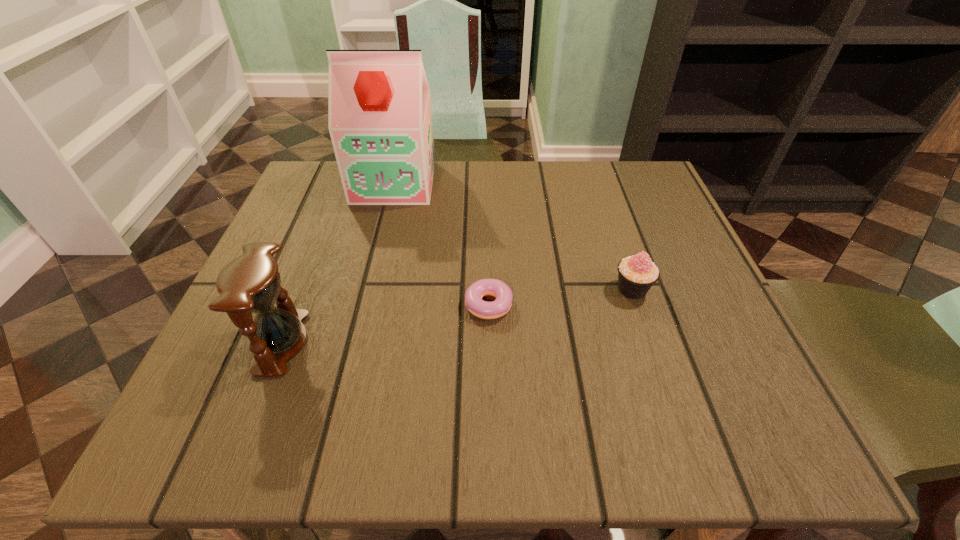
This screenshot has width=960, height=540. Identify the location of free space between the third shortest object and the third tallest object. (457, 316).

The width and height of the screenshot is (960, 540). I want to click on free space that is in between the third shortest object and the tallest object, so click(338, 262).

Find the location of `free space between the second tallest object and the tallest object`. free space between the second tallest object and the tallest object is located at coordinates (338, 262).

Locate an element on the screen. The height and width of the screenshot is (540, 960). the closest object to the third object from left to right is located at coordinates (636, 274).

You are a GUI agent. You are given a task and a screenshot of the screen. Output one action in this format:
    pyautogui.click(x=<x>, y=<y>)
    Task: Click on the object that is the second closest to the doughnut
    This screenshot has height=540, width=960.
    Given the screenshot: What is the action you would take?
    pyautogui.click(x=251, y=283)

The width and height of the screenshot is (960, 540). In order to click on vacant space that satisfies the following two spatial constraints: 1. with the cap open on the doughnut; 2. on the left side of the tallest object in this screenshot , I will do `click(364, 305)`.

Where is `free region that satisfies the following two spatial constraints: 1. with the cap open on the soya milk; 2. on the left side of the shortest object`? This screenshot has width=960, height=540. free region that satisfies the following two spatial constraints: 1. with the cap open on the soya milk; 2. on the left side of the shortest object is located at coordinates (364, 305).

The image size is (960, 540). In order to click on free space that satisfies the following two spatial constraints: 1. with the cap open on the soya milk; 2. on the left side of the doughnut in this screenshot , I will do `click(364, 305)`.

This screenshot has width=960, height=540. I want to click on blank space that satisfies the following two spatial constraints: 1. with the cap open on the soya milk; 2. on the right side of the third object from left to right, so click(x=364, y=305).

What are the coordinates of `vacant space that satisfies the following two spatial constraints: 1. with the cap open on the rightmost object; 2. on the left side of the farthest object` in the screenshot? It's located at (368, 289).